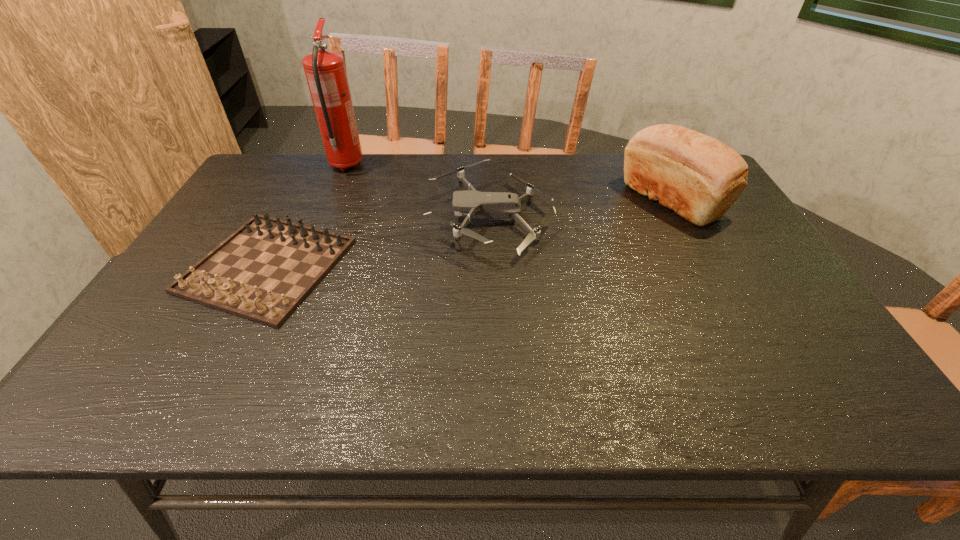
The width and height of the screenshot is (960, 540). Identify the location of fire extinguisher. [x=325, y=71].

Find the location of a particular element. The image size is (960, 540). bread is located at coordinates (698, 177).

Locate an element on the screen. The width and height of the screenshot is (960, 540). the rightmost object is located at coordinates (698, 177).

Locate an element on the screen. The width and height of the screenshot is (960, 540). drone is located at coordinates (478, 205).

Find the location of a particular element. chessboard is located at coordinates (263, 271).

Find the location of a particular element. free location located on the back of the bread is located at coordinates (647, 156).

Locate an element on the screen. vacant space located on the front-facing side of the drone is located at coordinates (356, 219).

Image resolution: width=960 pixels, height=540 pixels. Identify the location of free space located on the front-facing side of the drone. (387, 219).

The width and height of the screenshot is (960, 540). I want to click on vacant space located 0.250m on the front-facing side of the drone, so click(343, 219).

Locate an element on the screen. This screenshot has height=540, width=960. free space located on the back of the chessboard is located at coordinates (318, 166).